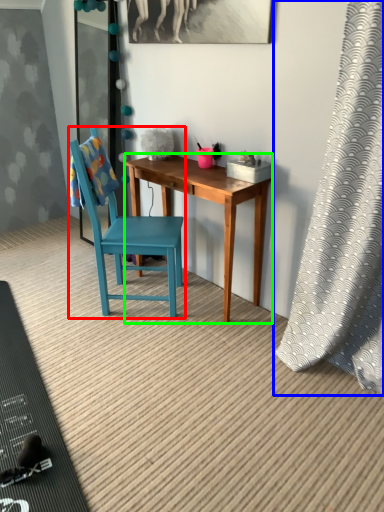
Question: Which object is positioned farthest from chair (highlighted by a red box)? Select from curtain (highlighted by a blue box) and desk (highlighted by a green box).

Choices:
 (A) curtain
 (B) desk

Answer: (A)